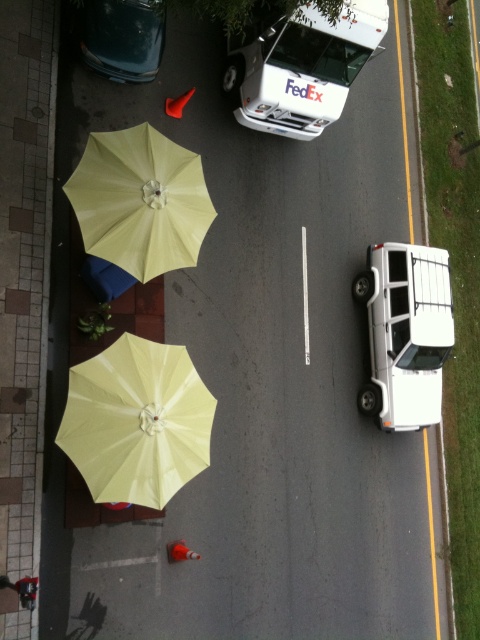
Question: Does yellow matte umbrella at upper left have a smaller size compared to white matte fedex van at upper center?

Choices:
 (A) yes
 (B) no

Answer: (A)

Question: Which object is positioned closest to the white matte fedex van at upper center?

Choices:
 (A) yellow fabric umbrella at lower left
 (B) yellow matte umbrella at upper left

Answer: (B)

Question: Estimate the real-world distances between objects in this image. Which object is closer to the yellow matte umbrella at upper left?

Choices:
 (A) white matte fedex van at upper center
 (B) white matte van at right
 (C) yellow fabric umbrella at lower left

Answer: (C)

Question: Is yellow fabric umbrella at lower left smaller than metallic blue car at upper left?

Choices:
 (A) no
 (B) yes

Answer: (A)

Question: Does yellow fabric umbrella at lower left have a smaller size compared to white matte fedex van at upper center?

Choices:
 (A) no
 (B) yes

Answer: (B)

Question: Estimate the real-world distances between objects in this image. Which object is farther from the yellow fabric umbrella at lower left?

Choices:
 (A) white matte van at right
 (B) metallic blue car at upper left

Answer: (B)